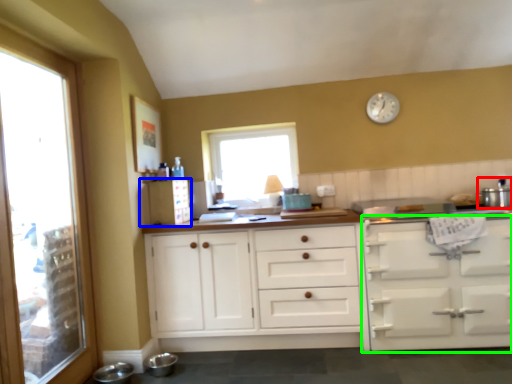
Question: Considering the real-world distances, which object is farthest from appliance (highlighted by a red box)? appliance (highlighted by a blue box) or cabinetry (highlighted by a green box)?

Choices:
 (A) appliance
 (B) cabinetry

Answer: (A)